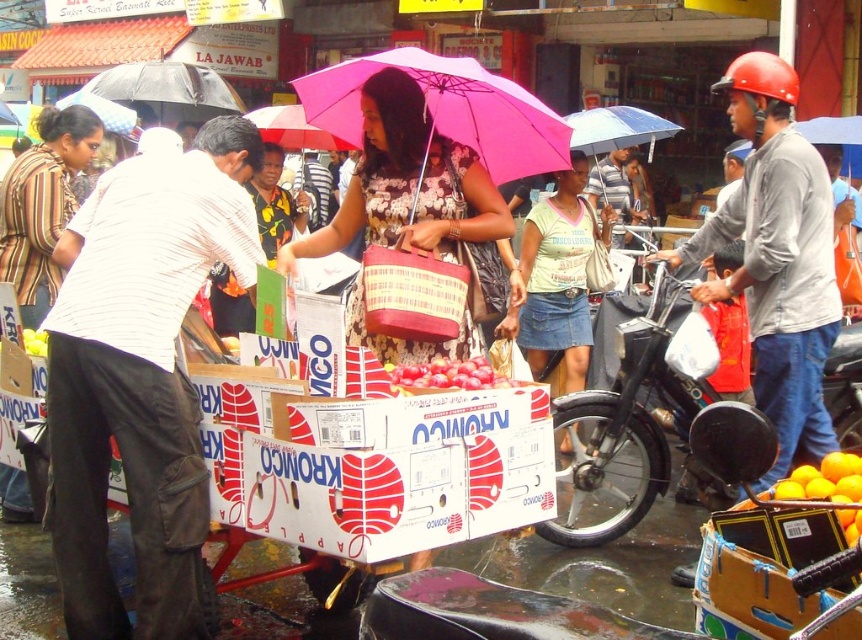
Based on the photo, you are a customer at the market and want to find the vendor wearing the light green cotton shirt at center. According to the coordinates provided, where should you look to find this vendor?

The light green cotton shirt at center is located at coordinates point (558, 276).

You are a delivery rider who needs to park your motorcycle and place your umbrella in a way that they don not block the narrow alleyway. Given the black matte motorcycle at center and the pink fabric umbrella at center, which item should you place closer to the wall to save space?

The pink fabric umbrella at center should be placed closer to the wall since it is smaller in size compared to the black matte motorcycle at center, allowing more space for the alleyway.

You are a delivery person who needs to load a package onto the black matte motorcycle at center. There is a matte gray shirt at center in the way. Can you move the motorcycle to make space?

The matte gray shirt at center is above the black matte motorcycle at center, so the motorcycle cannot be moved without disturbing the shirt, which might not be possible if it is part of the clothing on a person. Please check if the shirt is being worn by someone before attempting to move the motorcycle.